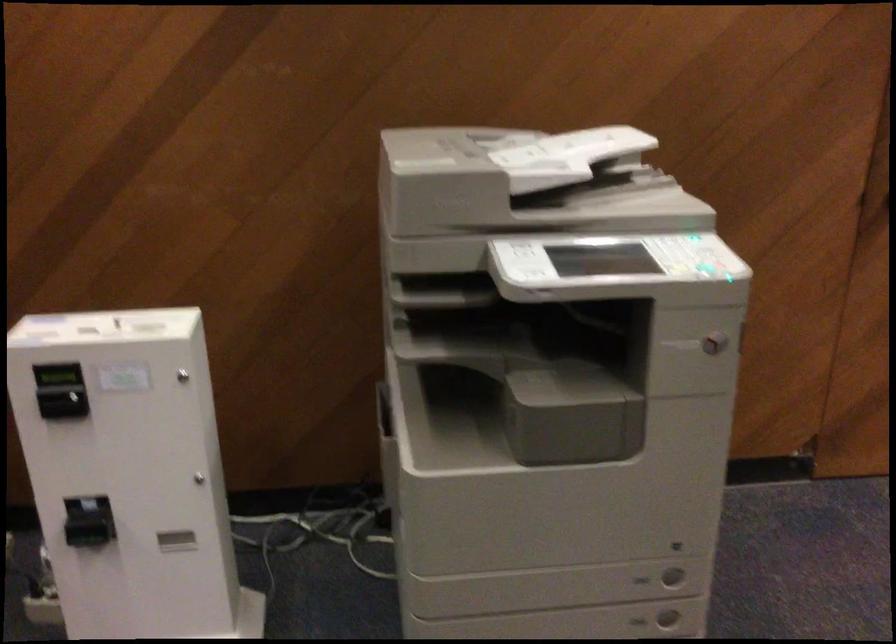
This screenshot has width=896, height=644. I want to click on card reader slot, so click(56, 375).